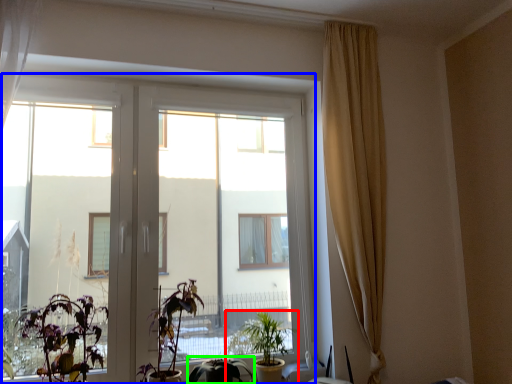
Question: Which object is positioned farthest from houseplant (highlighted by a red box)? Select from window (highlighted by a blue box) and houseplant (highlighted by a green box).

Choices:
 (A) window
 (B) houseplant

Answer: (A)